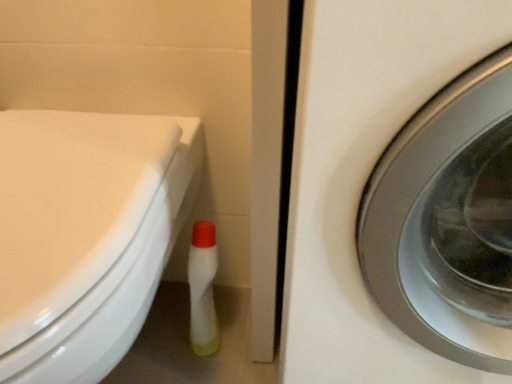
This screenshot has width=512, height=384. Describe the element at coordinates (364, 173) in the screenshot. I see `white glossy washing machine at center right` at that location.

What are the coordinates of `white glossy washing machine at center right` in the screenshot? It's located at (364, 173).

What do you see at coordinates (84, 228) in the screenshot? This screenshot has width=512, height=384. I see `white glossy bidet at lower left` at bounding box center [84, 228].

Locate an element on the screen. white glossy bidet at lower left is located at coordinates (84, 228).

Identify the location of white glossy washing machine at center right. This screenshot has height=384, width=512. (364, 173).

Which object is positioned more to the left, white glossy washing machine at center right or white glossy bidet at lower left?

white glossy bidet at lower left.

Between white glossy washing machine at center right and white glossy bidet at lower left, which one is positioned behind?

Positioned behind is white glossy bidet at lower left.

Which is less distant, (415, 343) or (10, 225)?

Point (415, 343) is farther from the camera than point (10, 225).

From the image's perspective, which is below, white glossy washing machine at center right or white glossy bidet at lower left?

white glossy bidet at lower left.

From a real-world perspective, is white glossy washing machine at center right physically below white glossy bidet at lower left?

Correct, in the physical world, white glossy washing machine at center right is lower than white glossy bidet at lower left.

Can you confirm if white glossy washing machine at center right is wider than white glossy bidet at lower left?

Indeed, white glossy washing machine at center right has a greater width compared to white glossy bidet at lower left.

Considering the sizes of objects white glossy washing machine at center right and white glossy bidet at lower left in the image provided, who is taller, white glossy washing machine at center right or white glossy bidet at lower left?

white glossy washing machine at center right.

Looking at this image, who is bigger, white glossy washing machine at center right or white glossy bidet at lower left?

white glossy washing machine at center right.

Is white glossy washing machine at center right completely or partially outside of white glossy bidet at lower left?

Indeed, white glossy washing machine at center right is completely outside white glossy bidet at lower left.

Does white glossy washing machine at center right touch white glossy bidet at lower left?

There is a gap between white glossy washing machine at center right and white glossy bidet at lower left.

Is white glossy washing machine at center right oriented towards white glossy bidet at lower left?

No, white glossy washing machine at center right is not aimed at white glossy bidet at lower left.

Looking at this image, how distant is white glossy washing machine at center right from white glossy bidet at lower left?

The distance of white glossy washing machine at center right from white glossy bidet at lower left is 26.00 centimeters.

In the image, there is a white glossy bidet at lower left. What are the coordinates of `washing machine below it (from a real-world perspective)` in the screenshot? It's located at (364, 173).

Considering the relative positions of white glossy bidet at lower left and white glossy washing machine at center right in the image provided, is white glossy bidet at lower left to the right of white glossy washing machine at center right from the viewer's perspective?

No.

Is white glossy bidet at lower left positioned in front of white glossy washing machine at center right?

No.

Between point (66, 380) and point (360, 9), which one is positioned behind?

The point (66, 380) is farther.

From the image's perspective, who appears lower, white glossy bidet at lower left or white glossy washing machine at center right?

From the image's view, white glossy bidet at lower left is below.

From a real-world perspective, is white glossy bidet at lower left above or below white glossy washing machine at center right?

From a real-world perspective, white glossy bidet at lower left is physically above white glossy washing machine at center right.

Is white glossy bidet at lower left wider than white glossy washing machine at center right?

Answer: No, white glossy bidet at lower left is not wider than white glossy washing machine at center right.

Considering the sizes of white glossy bidet at lower left and white glossy washing machine at center right in the image, is white glossy bidet at lower left taller or shorter than white glossy washing machine at center right?

white glossy bidet at lower left is shorter than white glossy washing machine at center right.

Can you confirm if white glossy bidet at lower left is bigger than white glossy washing machine at center right?

No.

Could white glossy washing machine at center right be considered to be inside white glossy bidet at lower left?

No, white glossy bidet at lower left does not contain white glossy washing machine at center right.

Is white glossy bidet at lower left with white glossy washing machine at center right?

No, white glossy bidet at lower left is not next to white glossy washing machine at center right.

Is white glossy washing machine at center right at the back of white glossy bidet at lower left?

white glossy bidet at lower left does not have its back to white glossy washing machine at center right.

Locate an element on the screen. washing machine below the white glossy bidet at lower left (from a real-world perspective) is located at coordinates (364, 173).

Locate an element on the screen. The width and height of the screenshot is (512, 384). bidet on the left side of white glossy washing machine at center right is located at coordinates (84, 228).

Where is `washing machine lying in front of the white glossy bidet at lower left`? washing machine lying in front of the white glossy bidet at lower left is located at coordinates (364, 173).